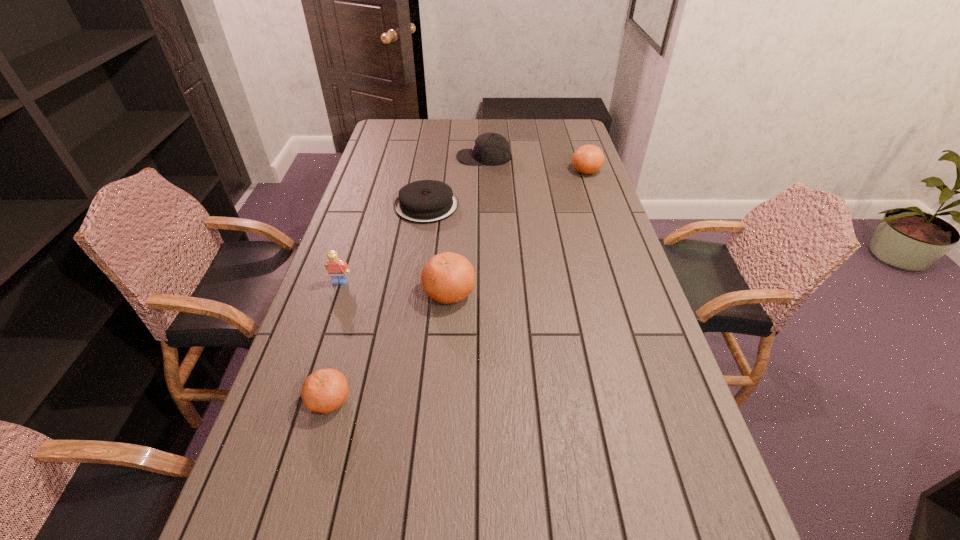
Locate an element on the screen. empty location between the second farthest clementine and the rightmost object is located at coordinates (517, 232).

You are a GUI agent. You are given a task and a screenshot of the screen. Output one action in this format:
    pyautogui.click(x=<x>, y=<y>)
    Task: Click on the free spot between the Lego and the second clementine from left to right
    The image size is (960, 540).
    Given the screenshot: What is the action you would take?
    pyautogui.click(x=395, y=287)

You are a GUI agent. You are given a task and a screenshot of the screen. Output one action in this format:
    pyautogui.click(x=<x>, y=<y>)
    Task: Click on the free space between the Lego and the pancake
    Image resolution: width=960 pixels, height=540 pixels.
    Given the screenshot: What is the action you would take?
    pyautogui.click(x=383, y=244)

Find the location of a particular element. The image size is (960, 540). empty space between the second farthest clementine and the second shortest clementine is located at coordinates (517, 232).

Where is `empty space that is in between the cap and the fourth nearest object`? The width and height of the screenshot is (960, 540). empty space that is in between the cap and the fourth nearest object is located at coordinates (455, 181).

Find the location of a particular element. free space between the cap and the nearest clementine is located at coordinates click(x=407, y=279).

You are a GUI agent. You are given a task and a screenshot of the screen. Output one action in this format:
    pyautogui.click(x=<x>, y=<y>)
    Task: Click on the vacant space that is in between the nearest object and the cap
    The image size is (960, 540).
    Given the screenshot: What is the action you would take?
    pyautogui.click(x=407, y=279)

Choose which object is the fifth nearest neighbor to the cap. Please provide its 2D coordinates. Your answer should be formatted as a tuple, i.e. [(x, y)], where the tuple contains the x and y coordinates of a point satisfying the conditions above.

[(325, 390)]

Where is `object that is the fourth closest to the rightmost object`? This screenshot has height=540, width=960. object that is the fourth closest to the rightmost object is located at coordinates (337, 268).

Select which clementine is the second closest to the second shortest clementine. Please provide its 2D coordinates. Your answer should be formatted as a tuple, i.e. [(x, y)], where the tuple contains the x and y coordinates of a point satisfying the conditions above.

[(325, 390)]